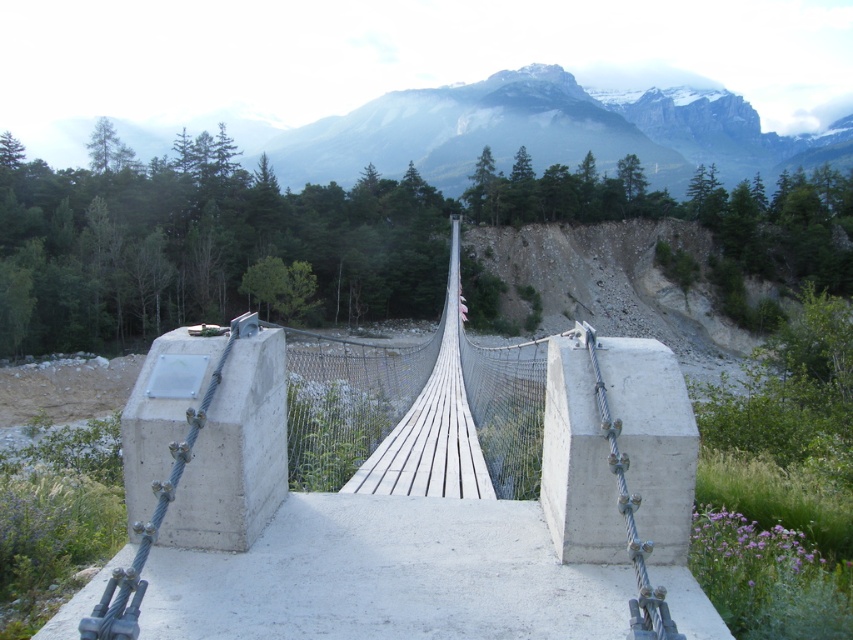
Question: Can you confirm if white concrete suspension bridge at center is positioned below gray rocky mountain at upper center?

Choices:
 (A) yes
 (B) no

Answer: (A)

Question: Can you confirm if white concrete suspension bridge at center is positioned above gray rocky mountain at upper center?

Choices:
 (A) no
 (B) yes

Answer: (A)

Question: Does white concrete suspension bridge at center appear over gray rocky mountain at upper center?

Choices:
 (A) no
 (B) yes

Answer: (A)

Question: Which object is closer to the camera taking this photo?

Choices:
 (A) gray rocky mountain at upper center
 (B) white concrete suspension bridge at center

Answer: (B)

Question: Which object appears farthest from the camera in this image?

Choices:
 (A) white concrete suspension bridge at center
 (B) gray rocky mountain at upper center

Answer: (B)